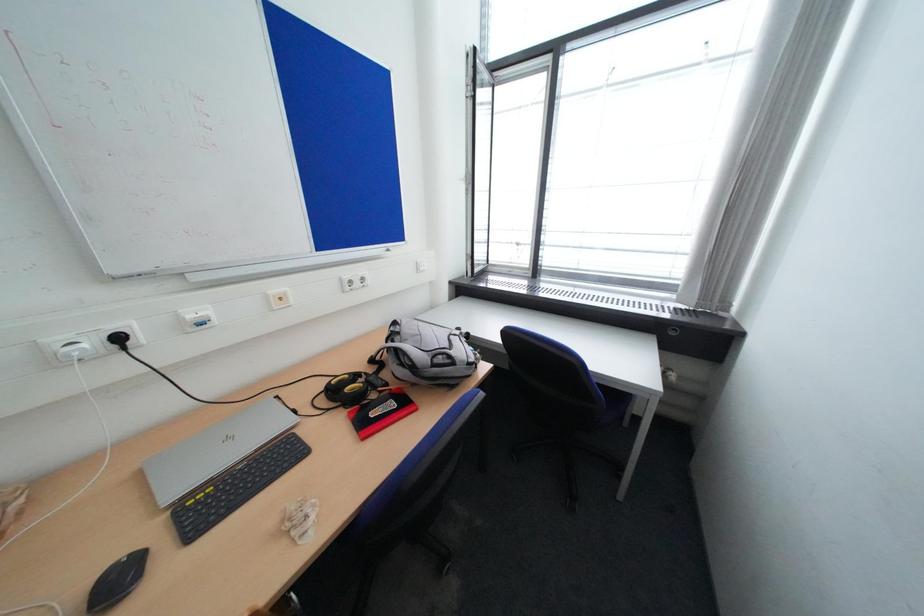
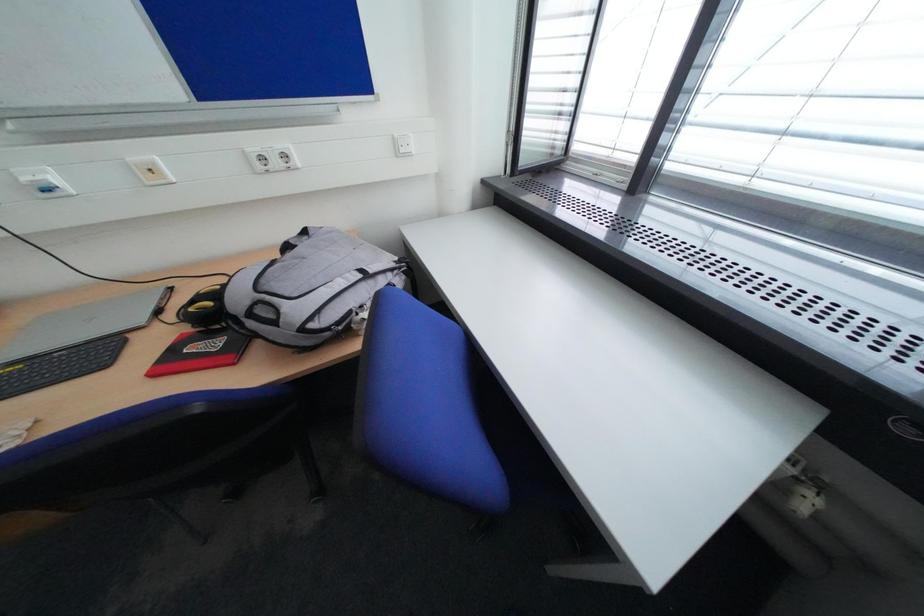
The images are taken continuously from a first-person perspective. In which direction is your viewpoint rotating?

The camera's rotation is toward left-down.